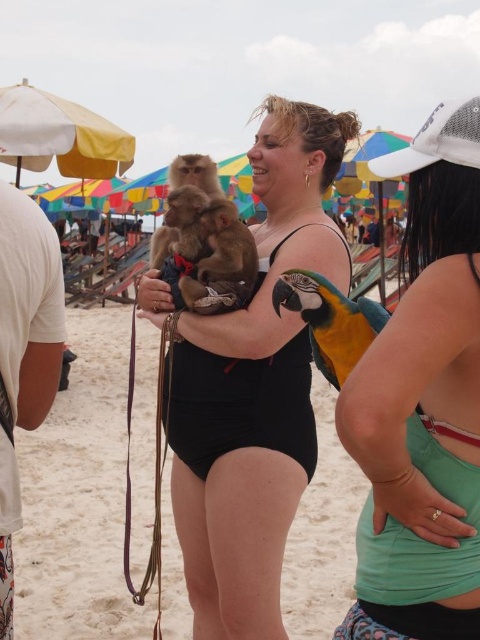
Which of these two, teal fabric tank top at right or brown fur monkey at center, stands shorter?

Standing shorter between the two is brown fur monkey at center.

The height and width of the screenshot is (640, 480). What do you see at coordinates (422, 404) in the screenshot?
I see `teal fabric tank top at right` at bounding box center [422, 404].

Where is `teal fabric tank top at right`? The width and height of the screenshot is (480, 640). teal fabric tank top at right is located at coordinates (422, 404).

Can you confirm if brown fur monkey at center is positioned below blue-green macaw at center?

No, brown fur monkey at center is not below blue-green macaw at center.

Which is behind, point (210, 273) or point (357, 349)?

Point (210, 273)

This screenshot has width=480, height=640. What are the coordinates of `brown fur monkey at center` in the screenshot? It's located at (215, 257).

Is yellow fabric umbrella at upper left shorter than blue-green macaw at center?

No, yellow fabric umbrella at upper left is not shorter than blue-green macaw at center.

The width and height of the screenshot is (480, 640). Describe the element at coordinates (59, 134) in the screenshot. I see `yellow fabric umbrella at upper left` at that location.

Measure the distance between point (57, 116) and camera.

They are 10.13 meters apart.

The height and width of the screenshot is (640, 480). Find the location of `yellow fabric umbrella at upper left`. yellow fabric umbrella at upper left is located at coordinates (59, 134).